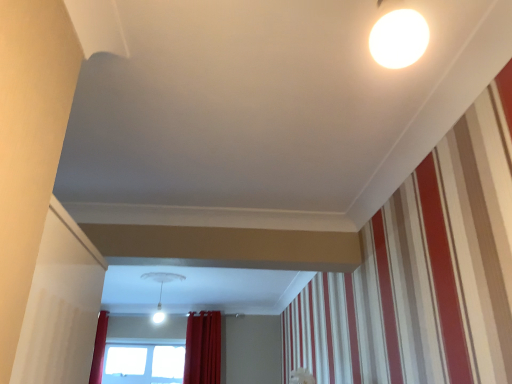
Question: Considering the positions of red velvet curtain at lower center and transparent glass window at lower center in the image, is red velvet curtain at lower center taller or shorter than transparent glass window at lower center?

Choices:
 (A) tall
 (B) short

Answer: (A)

Question: Considering their positions, is red velvet curtain at lower center located in front of or behind transparent glass window at lower center?

Choices:
 (A) front
 (B) behind

Answer: (A)

Question: Based on their relative distances, which object is farther from the red velvet curtain at lower center?

Choices:
 (A) white glossy light fixture at center
 (B) transparent glass window at lower center

Answer: (A)

Question: Based on their relative distances, which object is nearer to the red velvet curtain at lower center?

Choices:
 (A) transparent glass window at lower center
 (B) white glossy light fixture at center

Answer: (A)